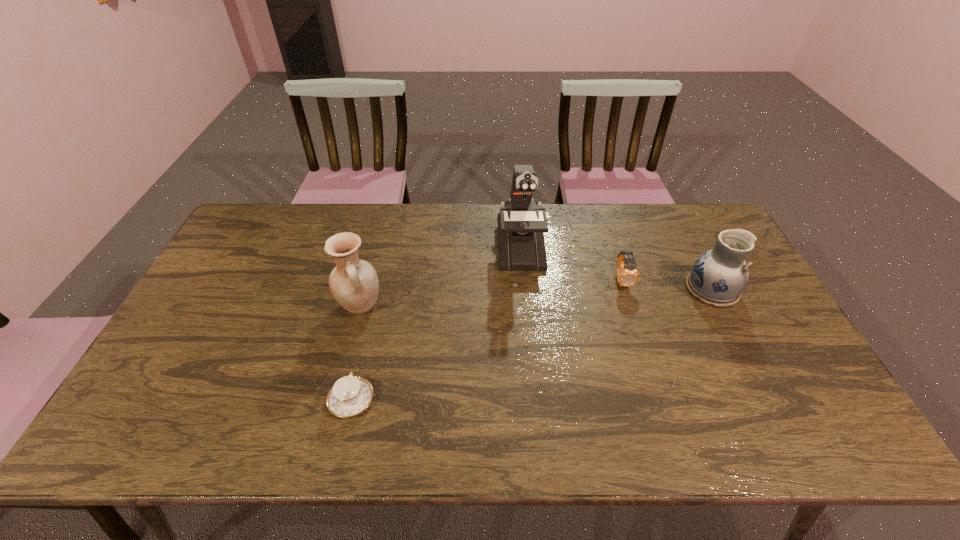
This screenshot has height=540, width=960. I want to click on microscope, so click(x=520, y=224).

This screenshot has width=960, height=540. Identify the location of the tallest object. (520, 224).

Where is `the left pottery`? Image resolution: width=960 pixels, height=540 pixels. the left pottery is located at coordinates (354, 283).

You are a GUI agent. You are given a task and a screenshot of the screen. Output one action in this format:
    pyautogui.click(x=<x>, y=<y>)
    Task: Click on the shorter pottery
    
    Given the screenshot: What is the action you would take?
    pyautogui.click(x=719, y=276)

Where is `the rightmost object`? The height and width of the screenshot is (540, 960). the rightmost object is located at coordinates (719, 276).

The image size is (960, 540). I want to click on the second object from right to left, so click(628, 276).

Find the location of `watch`. watch is located at coordinates (628, 276).

The height and width of the screenshot is (540, 960). I want to click on teacup, so click(350, 395).

Image resolution: width=960 pixels, height=540 pixels. Identify the location of the nearest object. (350, 395).

This screenshot has height=540, width=960. I want to click on free region located through the eyepieces of the microscope, so click(531, 359).